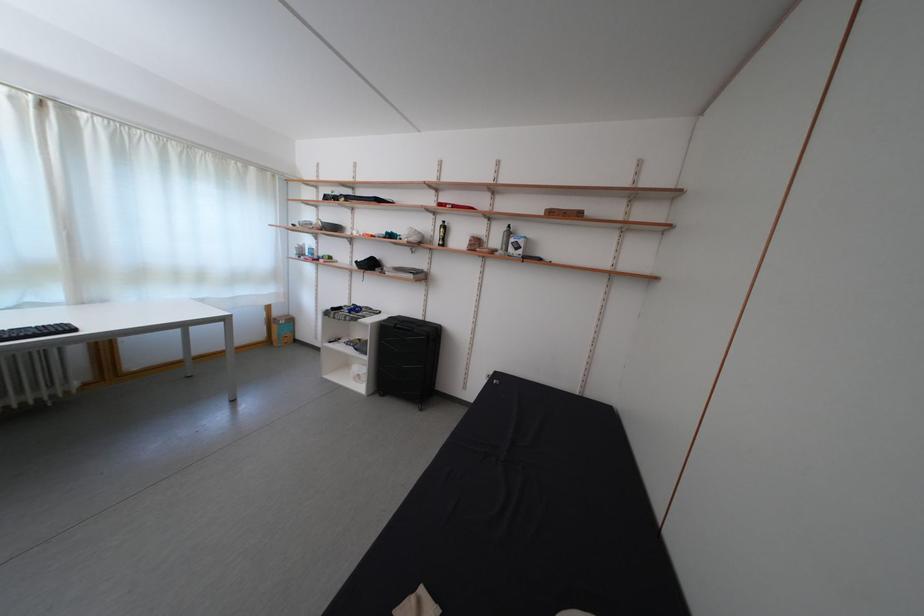
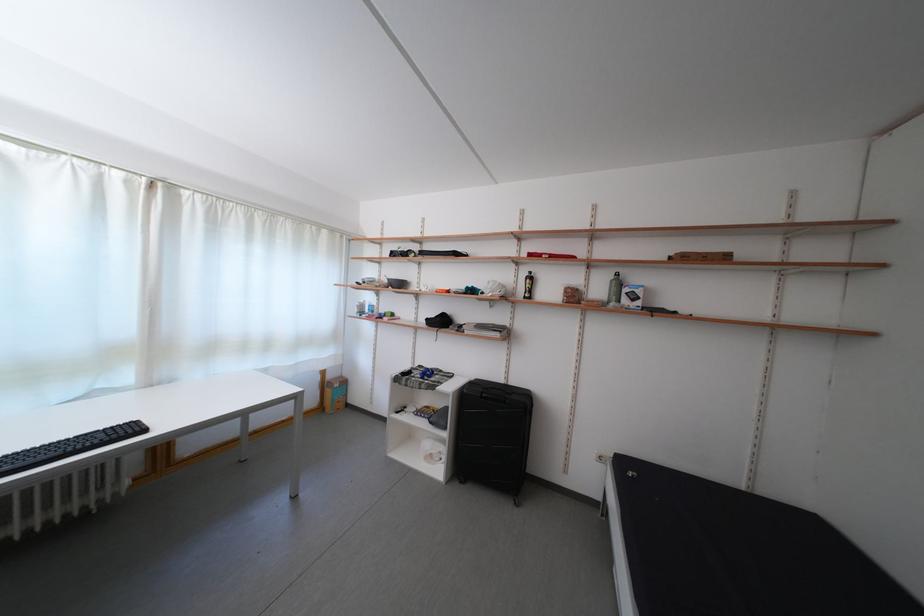
Question: The first image is from the beginning of the video and the second image is from the end. How did the camera likely rotate when shooting the video?

Choices:
 (A) Left
 (B) Right
 (C) Up
 (D) Down

Answer: (C)